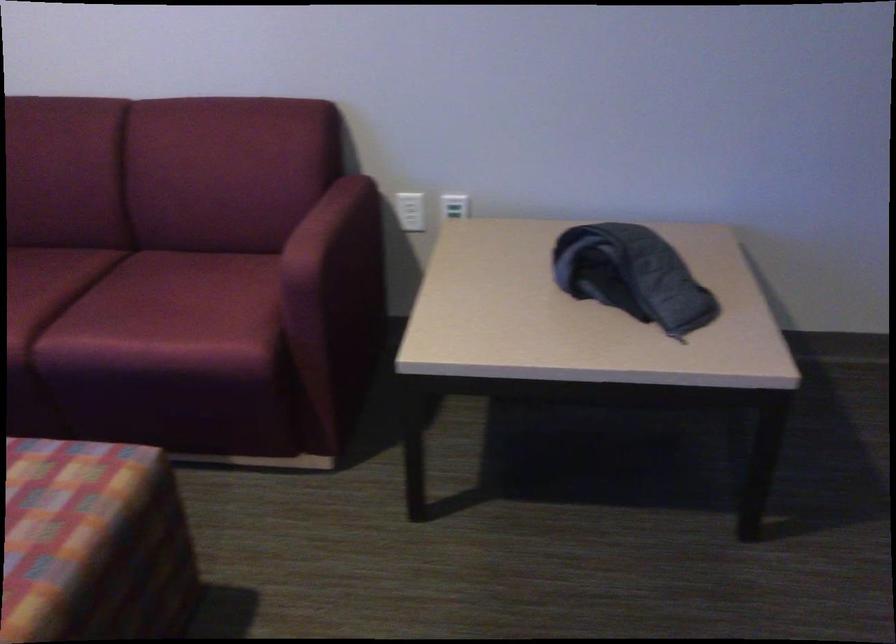
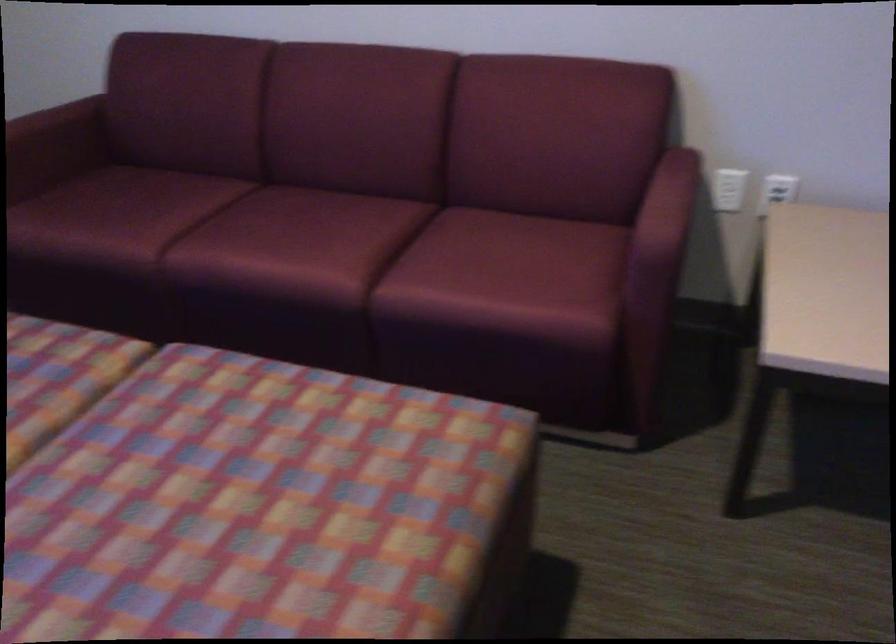
The point at (455, 205) is marked in the first image. Where is the corresponding point in the second image?

(777, 190)